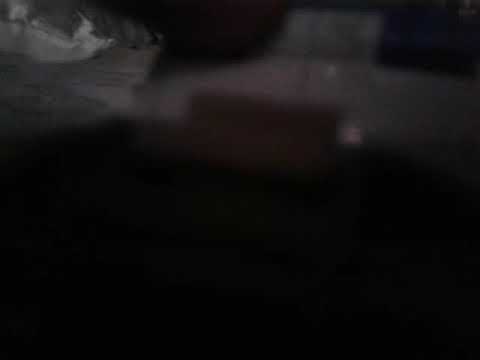
Where is `shadow of bottom of cabinet in background`? The image size is (480, 360). shadow of bottom of cabinet in background is located at coordinates (412, 210).